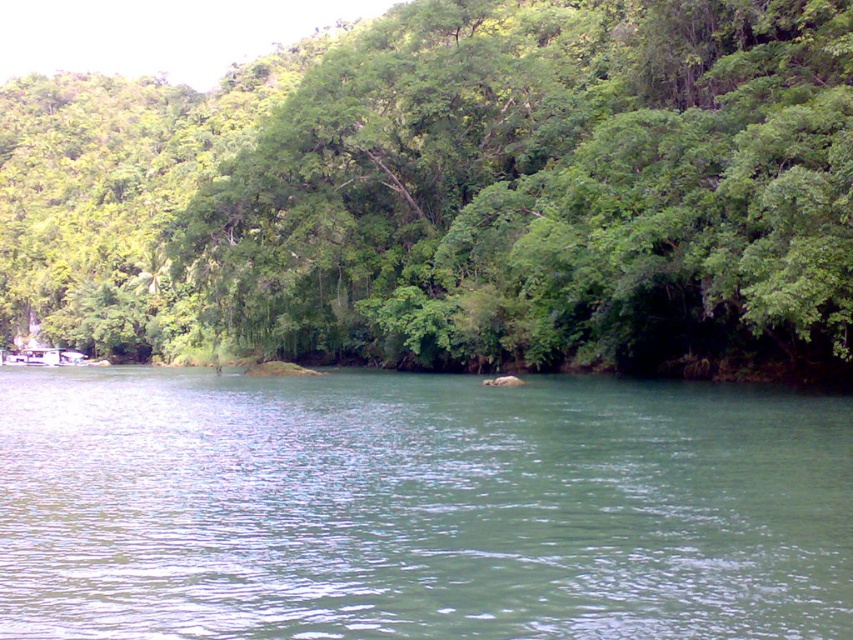
Question: Which point is farther from the camera taking this photo?

Choices:
 (A) (793, 499)
 (B) (525, 65)

Answer: (B)

Question: Is green leafy trees at upper left to the right of green smooth water at center from the viewer's perspective?

Choices:
 (A) yes
 (B) no

Answer: (B)

Question: Is green leafy trees at upper left to the right of green smooth water at center from the viewer's perspective?

Choices:
 (A) yes
 (B) no

Answer: (B)

Question: Is green leafy trees at upper left positioned in front of green smooth water at center?

Choices:
 (A) yes
 (B) no

Answer: (B)

Question: Which point is farther to the camera?

Choices:
 (A) (727, 627)
 (B) (323, 67)

Answer: (B)